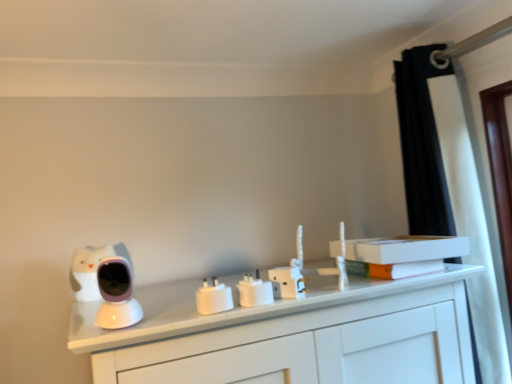
Question: Considering the positions of point (398, 266) and point (429, 140), is point (398, 266) closer or farther from the camera than point (429, 140)?

Choices:
 (A) farther
 (B) closer

Answer: (B)

Question: From the image's perspective, is orange matte book at upper right, acting as the 1th book starting from the bottom, located above or below black fabric curtain at upper right?

Choices:
 (A) above
 (B) below

Answer: (B)

Question: Considering the real-world distances, which object is closest to the purple glossy baby monitor at left?

Choices:
 (A) white plastic electric outlet at center, which is counted as the 1th electric outlet, starting from the right
 (B) orange matte book at upper right, acting as the 1th book starting from the bottom
 (C) white plastic power adapter at center, which is the 1th electric outlet from left to right
 (D) white plastic electric outlet at center, the second electric outlet from the left
 (E) white matte book at upper right, placed as the 1th book when sorted from top to bottom

Answer: (C)

Question: Which of these objects is positioned closest to the orange matte book at upper right, which is the 2th book in top-to-bottom order?

Choices:
 (A) white plastic electric outlet at center, which is counted as the 1th electric outlet, starting from the right
 (B) black fabric curtain at upper right
 (C) white plastic electric outlet at center, the second electric outlet in the right-to-left sequence
 (D) white matte book at upper right, placed as the 1th book when sorted from top to bottom
 (E) white plastic power adapter at center, which is the third electric outlet in right-to-left order

Answer: (D)